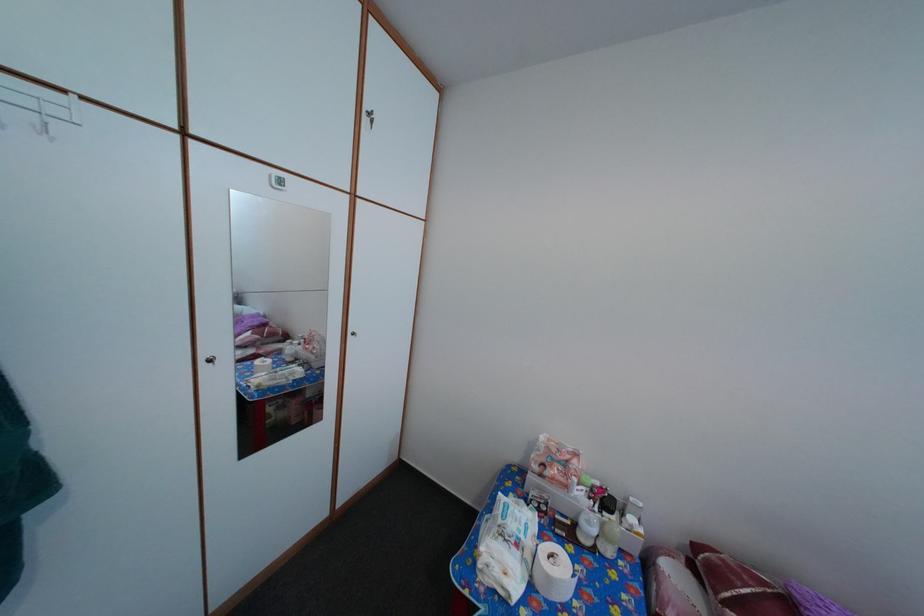
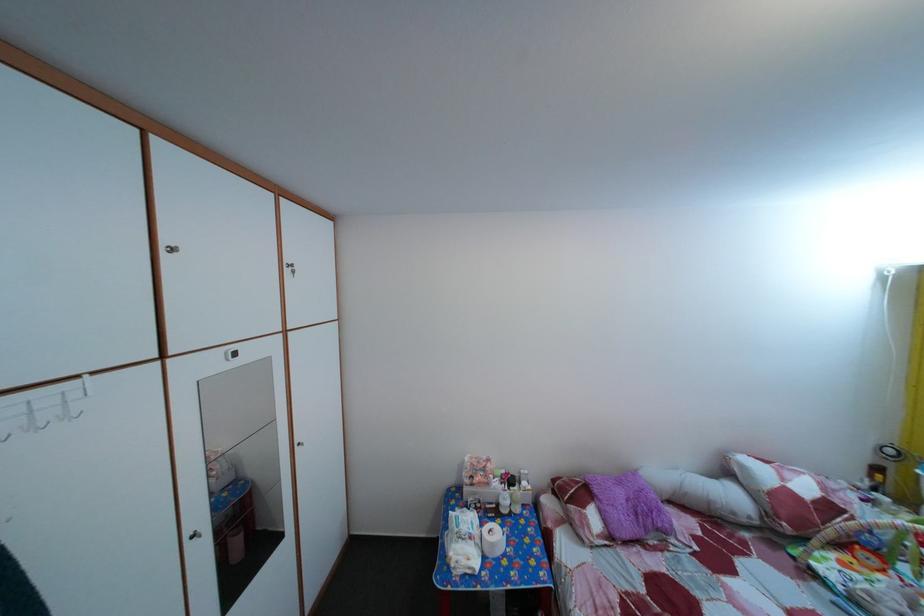
The point at (71, 99) is marked in the first image. Where is the corresponding point in the second image?

(86, 384)